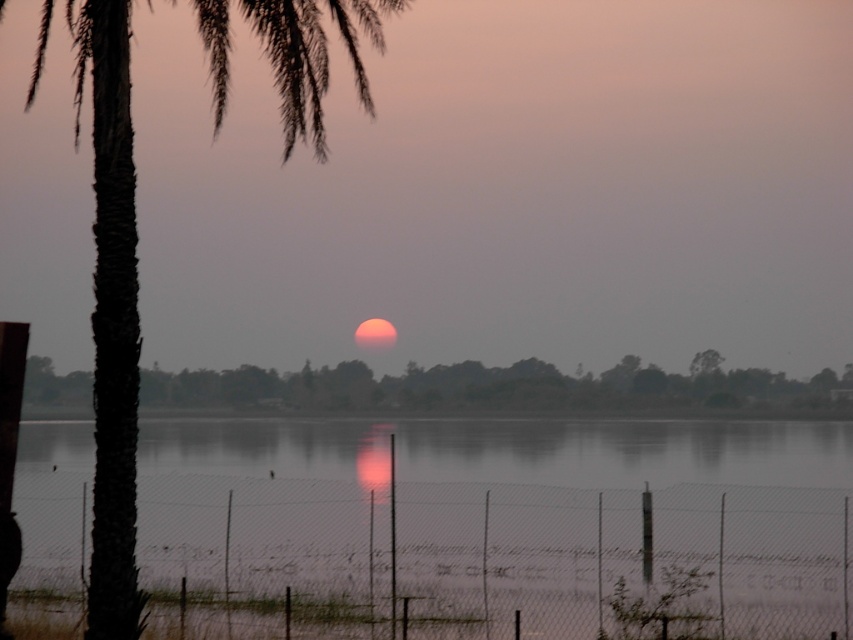
You are standing at the point marked by the coordinates point (111, 312) in the sunset scene. What object are you standing on?

You are standing on the dark brown textured palm tree at left, as the coordinates point (111, 312) marks this object in the scene.

You are standing on the shore looking at the sunset. There is a wire mesh fence at lower center and a green leafy tree at center. Which object is closer to the left side of your view?

The wire mesh fence at lower center is to the left of the green leafy tree at center, so it is closer to the left side of your view.